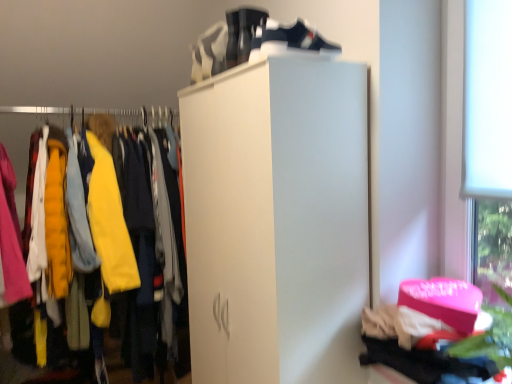
Question: Is white matte closet at left beside white matte running shoe at upper center?

Choices:
 (A) no
 (B) yes

Answer: (A)

Question: Considering the relative sizes of white matte closet at left and white matte running shoe at upper center in the image provided, is white matte closet at left taller than white matte running shoe at upper center?

Choices:
 (A) no
 (B) yes

Answer: (B)

Question: Does white matte closet at left have a lesser height compared to white matte running shoe at upper center?

Choices:
 (A) yes
 (B) no

Answer: (B)

Question: From the image's perspective, would you say white matte closet at left is positioned over white matte running shoe at upper center?

Choices:
 (A) yes
 (B) no

Answer: (B)

Question: Is white matte closet at left facing towards white matte running shoe at upper center?

Choices:
 (A) no
 (B) yes

Answer: (B)

Question: Is point (254, 13) positioned closer to the camera than point (69, 173)?

Choices:
 (A) closer
 (B) farther

Answer: (A)

Question: In the image, is white matte running shoe at upper center positioned in front of or behind white matte closet at left?

Choices:
 (A) behind
 (B) front

Answer: (B)

Question: Is white matte running shoe at upper center taller or shorter than white matte closet at left?

Choices:
 (A) tall
 (B) short

Answer: (B)

Question: From the image's perspective, is white matte running shoe at upper center located above or below white matte closet at left?

Choices:
 (A) above
 (B) below

Answer: (A)

Question: In terms of height, does white matte closet at left look taller or shorter compared to white leather shoe at upper center?

Choices:
 (A) short
 (B) tall

Answer: (B)

Question: Would you say white matte closet at left is inside or outside white leather shoe at upper center?

Choices:
 (A) outside
 (B) inside

Answer: (A)

Question: Does point (99, 240) appear closer or farther from the camera than point (275, 29)?

Choices:
 (A) closer
 (B) farther

Answer: (B)

Question: From a real-world perspective, relative to white leather shoe at upper center, is white matte closet at left vertically above or below?

Choices:
 (A) below
 (B) above

Answer: (A)

Question: From their relative heights in the image, would you say white leather shoe at upper center is taller or shorter than white matte running shoe at upper center?

Choices:
 (A) short
 (B) tall

Answer: (A)

Question: Relative to white matte running shoe at upper center, is white leather shoe at upper center in front or behind?

Choices:
 (A) behind
 (B) front

Answer: (B)